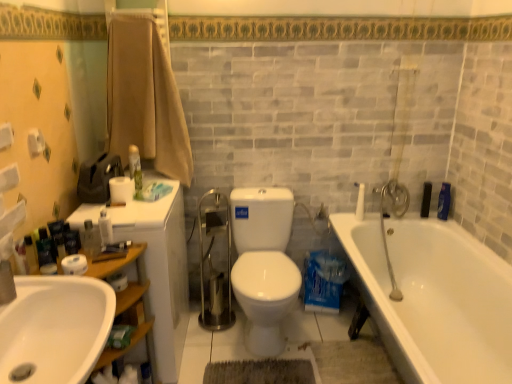
You are a GUI agent. You are given a task and a screenshot of the screen. Output one action in this format:
    pyautogui.click(x=<x>, y=<y>)
    Task: Click on the free spot in front of blue plastic bottle at right, which is the 1th toiletry in right-to-left order
    
    Given the screenshot: What is the action you would take?
    tap(448, 228)